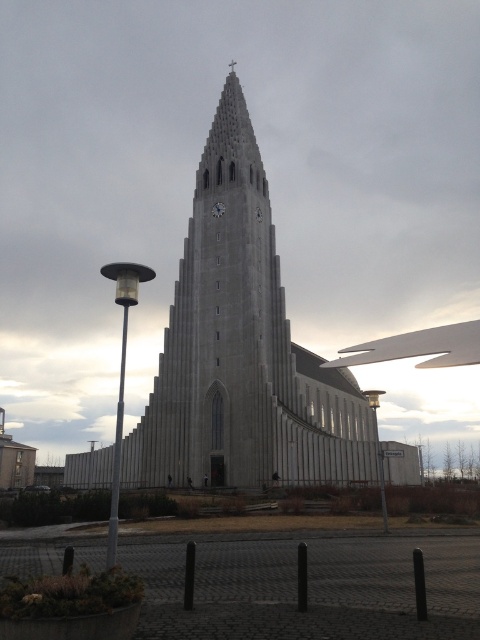
You are a tourist standing in front of the gray stone church at center and the metallic clock at center. Which object is positioned higher in the image?

The metallic clock at center is positioned higher than the gray stone church at center in the image.

Based on the scene description, what are the coordinates of the gray stone church at center?

The gray stone church at center is located at coordinates point (241, 349).

You are a city planner assessing the space in front of the gray stone church at center and the metallic clock at center. Based on their widths, which object would require more horizontal space for maintenance vehicles to maneuver around?

The gray stone church at center might be wider than metallic clock at center, so it would require more horizontal space for maintenance vehicles to maneuver around.